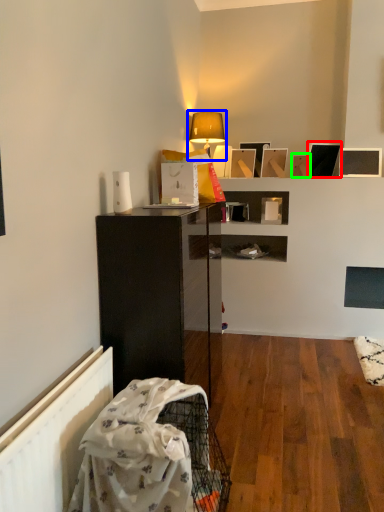
Question: Which object is the closest to the picture frame (highlighted by a red box)? Choose among these: lamp (highlighted by a blue box) or picture frame (highlighted by a green box).

Choices:
 (A) lamp
 (B) picture frame

Answer: (B)